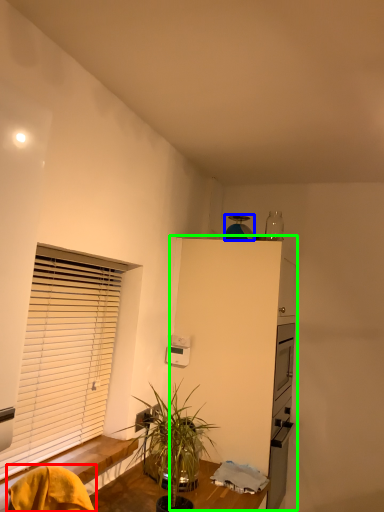
Question: Which object is positioned farthest from swivel chair (highlighted by a red box)? Select from appliance (highlighted by a blue box) and dresser (highlighted by a green box).

Choices:
 (A) appliance
 (B) dresser

Answer: (A)